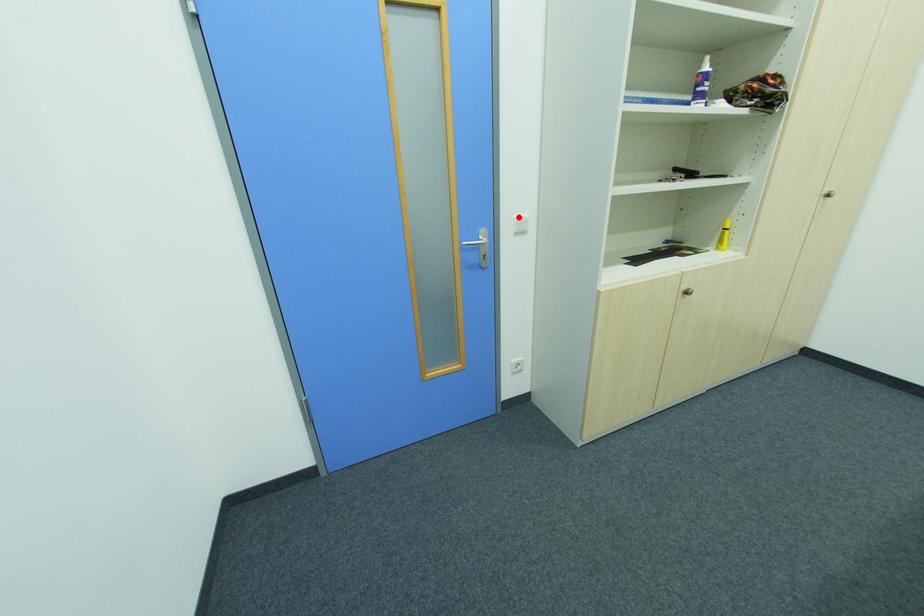
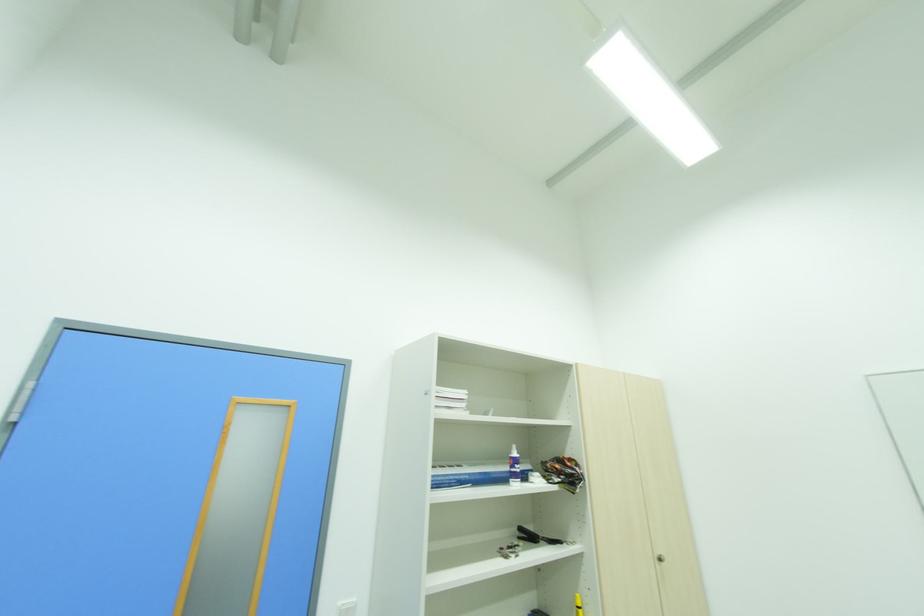
The point at the highlighted location is marked in the first image. Where is the corresponding point in the second image?

(344, 604)